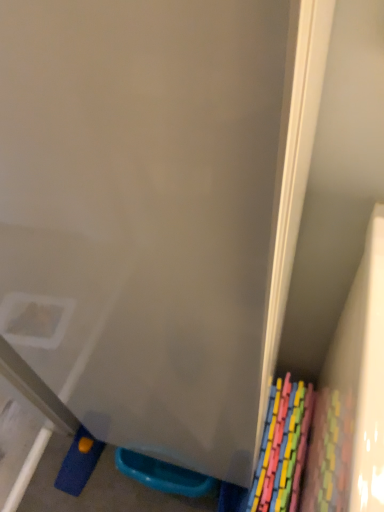
This screenshot has height=512, width=384. Describe the element at coordinates (283, 448) in the screenshot. I see `pastel plastic blocks at lower right` at that location.

Identify the location of pastel plastic blocks at lower right. This screenshot has width=384, height=512. (283, 448).

Identify the location of pastel plastic blocks at lower right. (283, 448).